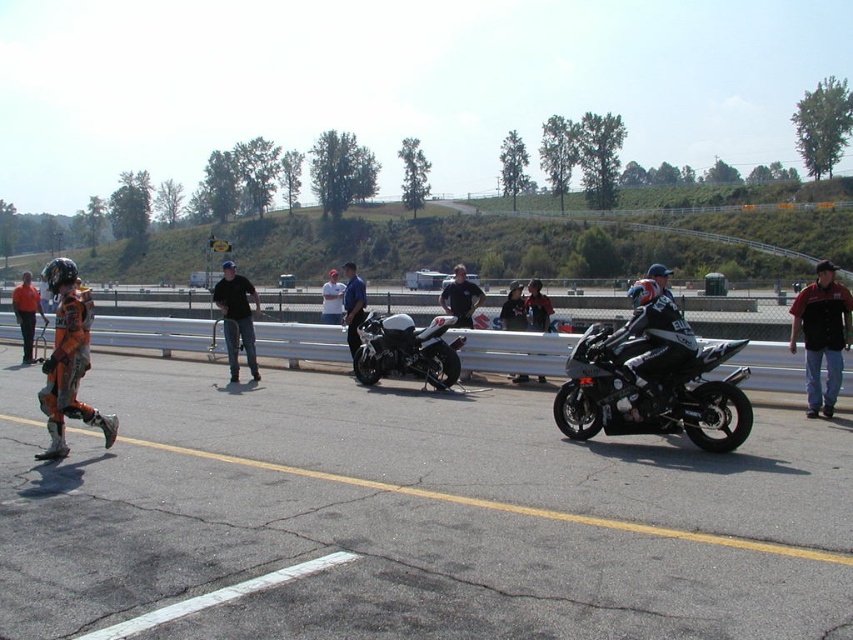
Can you confirm if asphalt at lower center is shorter than orange/black/white suit at left?

Yes.

Is asphalt at lower center wider than orange/black/white suit at left?

Yes, asphalt at lower center is wider than orange/black/white suit at left.

Where is `asphalt at lower center`? The height and width of the screenshot is (640, 853). asphalt at lower center is located at coordinates (407, 516).

Which of these two, black leather jacket at right or orange protective suit at center, stands taller?

orange protective suit at center

Looking at this image, which is above, black leather jacket at right or orange protective suit at center?

orange protective suit at center

This screenshot has height=640, width=853. In order to click on black leather jacket at right in this screenshot , I will do click(822, 336).

Can you confirm if orange/black/white suit at left is shorter than orange racing suit at center?

Yes, orange/black/white suit at left is shorter than orange racing suit at center.

Which is in front, point (49, 390) or point (328, 298)?

Point (49, 390) is in front.

Between point (107, 435) and point (322, 291), which one is positioned behind?

Positioned behind is point (322, 291).

The height and width of the screenshot is (640, 853). I want to click on orange/black/white suit at left, so click(68, 362).